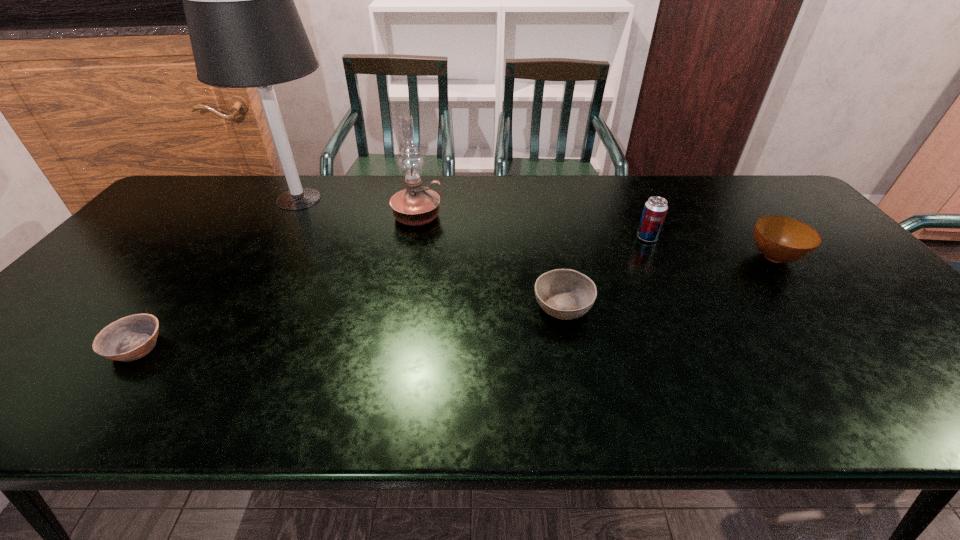
I want to click on free space that is in between the leftmost bowl and the rightmost object, so click(455, 302).

Where is `free spot between the beer can and the oil lamp`? Image resolution: width=960 pixels, height=540 pixels. free spot between the beer can and the oil lamp is located at coordinates (532, 227).

The image size is (960, 540). What are the coordinates of `free point between the table lamp and the second object from right to left` in the screenshot? It's located at (473, 218).

The height and width of the screenshot is (540, 960). Find the location of `free point between the farthest bowl and the shortest object`. free point between the farthest bowl and the shortest object is located at coordinates (455, 302).

Locate an element on the screen. free spot between the shortest bowl and the second shortest bowl is located at coordinates (349, 326).

The height and width of the screenshot is (540, 960). I want to click on object that is the nearest to the tallest object, so click(x=416, y=205).

This screenshot has height=540, width=960. I want to click on object that is the second closest to the beer can, so click(566, 294).

The image size is (960, 540). In order to click on bowl that is the second closest to the fourth object from right to left in this screenshot , I will do `click(132, 337)`.

Select which bowl is the second closest to the farthest bowl. Please provide its 2D coordinates. Your answer should be formatted as a tuple, i.e. [(x, y)], where the tuple contains the x and y coordinates of a point satisfying the conditions above.

[(132, 337)]

I want to click on vacant region that satisfies the following two spatial constraints: 1. on the back side of the third tallest object; 2. on the left side of the shortest bowl, so click(218, 238).